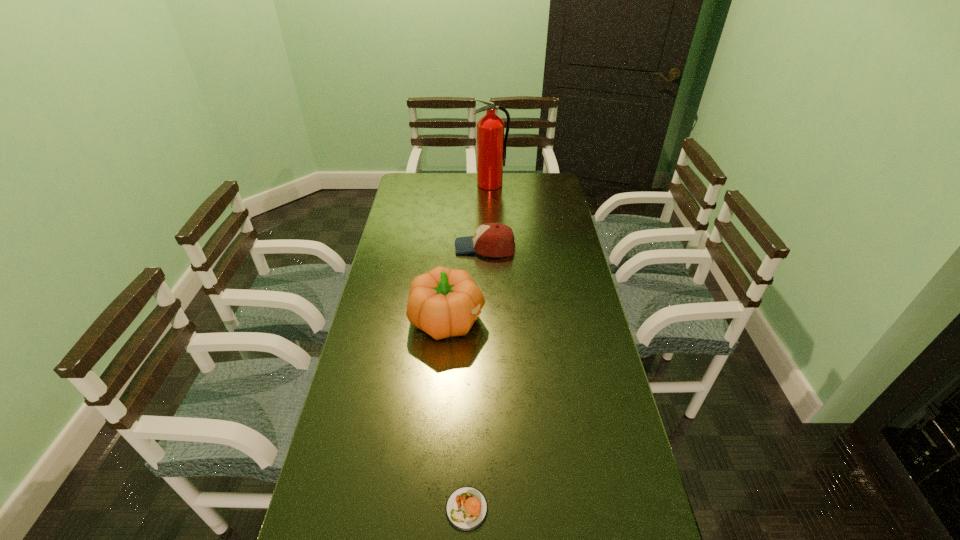
Identify the location of vacant space positioned on the front-facing side of the third nearest object. (410, 247).

Find the location of a particular element. vacant space located 0.240m on the front-facing side of the third nearest object is located at coordinates (x=395, y=247).

The height and width of the screenshot is (540, 960). What are the coordinates of `free space located on the front-facing side of the third nearest object` in the screenshot? It's located at (405, 247).

Identify the location of blank area located on the right of the shortest object. (531, 509).

The height and width of the screenshot is (540, 960). Identify the location of object situated at the far edge. (491, 145).

Identify the location of object that is positioned at the left edge. (443, 302).

Where is `free space at the far edge`? Image resolution: width=960 pixels, height=540 pixels. free space at the far edge is located at coordinates (464, 180).

The width and height of the screenshot is (960, 540). I want to click on free space at the left edge, so click(x=379, y=354).

This screenshot has width=960, height=540. In the image, there is a desktop. Find the location of `free region at the right edge`. free region at the right edge is located at coordinates (570, 271).

I want to click on vacant area between the third nearest object and the nearest object, so click(x=476, y=378).